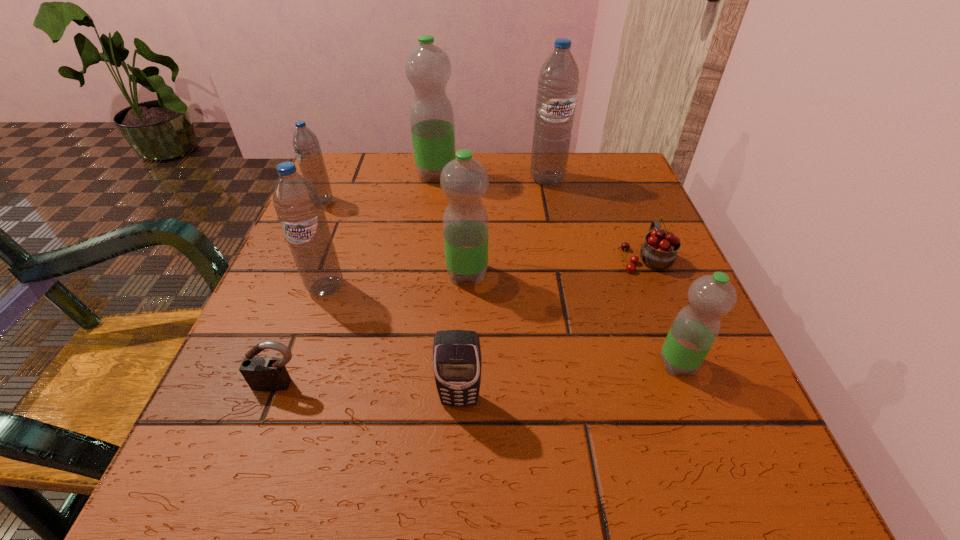
Where is `the farthest green water bottle`? the farthest green water bottle is located at coordinates click(x=428, y=68).

In order to click on the third object from right to left in this screenshot , I will do `click(558, 81)`.

At what (x,y) coordinates should I click in order to perform the action: click on the farthest blue water bottle. Please return your answer as a coordinate pair (x, y). This screenshot has height=540, width=960. Looking at the image, I should click on (558, 81).

Locate an element on the screen. This screenshot has width=960, height=540. the second smallest green water bottle is located at coordinates (464, 180).

You are a GUI agent. You are given a task and a screenshot of the screen. Output one action in this format:
    pyautogui.click(x=<x>, y=<y>)
    Task: Click on the nearest blue water bottle
    
    Given the screenshot: What is the action you would take?
    pyautogui.click(x=298, y=206)

I want to click on the second blue water bottle from right to left, so click(298, 206).

The image size is (960, 540). In order to click on the leftmost water bottle in this screenshot , I will do `click(306, 145)`.

Where is `the leftmost blue water bottle`? The image size is (960, 540). the leftmost blue water bottle is located at coordinates (306, 145).

Where is `the nearest green water bottle`? the nearest green water bottle is located at coordinates (695, 328).

At what (x,y) coordinates should I click in order to perform the action: click on the smallest green water bottle. Please return your answer as a coordinate pair (x, y). Looking at the image, I should click on (695, 328).